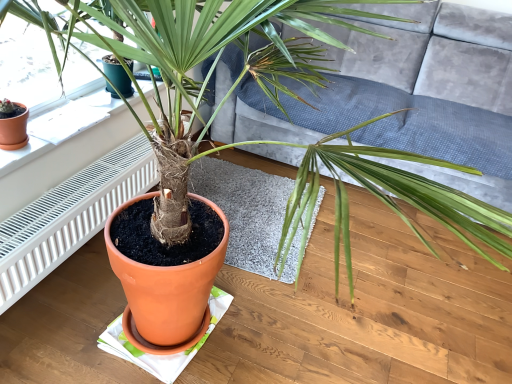
Question: From a real-world perspective, does white paper at upper left sit lower than white textured radiator at left?

Choices:
 (A) no
 (B) yes

Answer: (A)

Question: Considering the relative sizes of white paper at upper left and white textured radiator at left in the image provided, is white paper at upper left bigger than white textured radiator at left?

Choices:
 (A) no
 (B) yes

Answer: (A)

Question: Is white paper at upper left facing towards white textured radiator at left?

Choices:
 (A) no
 (B) yes

Answer: (A)

Question: Would you consider white paper at upper left to be distant from white textured radiator at left?

Choices:
 (A) no
 (B) yes

Answer: (A)

Question: Is white paper at upper left positioned with its back to white textured radiator at left?

Choices:
 (A) no
 (B) yes

Answer: (A)

Question: In terms of size, does velvet grey couch at center appear bigger or smaller than gray soft rug at center?

Choices:
 (A) small
 (B) big

Answer: (B)

Question: Considering the positions of velvet grey couch at center and gray soft rug at center in the image, is velvet grey couch at center wider or thinner than gray soft rug at center?

Choices:
 (A) thin
 (B) wide

Answer: (B)

Question: Is velvet grey couch at center spatially inside gray soft rug at center, or outside of it?

Choices:
 (A) outside
 (B) inside

Answer: (A)

Question: From the image's perspective, is velvet grey couch at center positioned above or below gray soft rug at center?

Choices:
 (A) below
 (B) above

Answer: (B)

Question: Considering the positions of white paper at upper left and velvet grey couch at center in the image, is white paper at upper left wider or thinner than velvet grey couch at center?

Choices:
 (A) wide
 (B) thin

Answer: (B)

Question: In the image, is white paper at upper left on the left side or the right side of velvet grey couch at center?

Choices:
 (A) left
 (B) right

Answer: (A)

Question: From their relative heights in the image, would you say white paper at upper left is taller or shorter than velvet grey couch at center?

Choices:
 (A) short
 (B) tall

Answer: (A)

Question: Is white paper at upper left bigger or smaller than velvet grey couch at center?

Choices:
 (A) big
 (B) small

Answer: (B)

Question: Is point (269, 210) positioned closer to the camera than point (338, 49)?

Choices:
 (A) closer
 (B) farther

Answer: (A)

Question: From the image's perspective, is gray soft rug at center above or below velvet grey couch at center?

Choices:
 (A) below
 (B) above

Answer: (A)